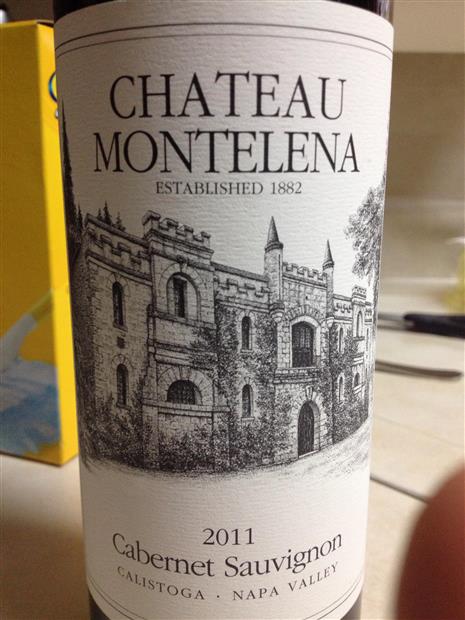
Locate an element on the screen. The image size is (465, 620). upper wall tan is located at coordinates (437, 4), (445, 38).